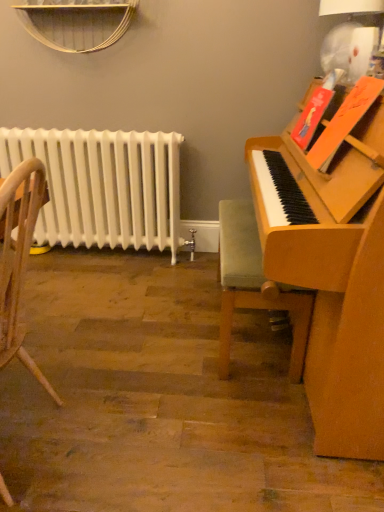
Question: Is white painted metal radiator at left positioned with its back to velvet green cushioned chair at right, which is counted as the second chair, starting from the left?

Choices:
 (A) no
 (B) yes

Answer: (A)

Question: Does white painted metal radiator at left turn towards velvet green cushioned chair at right, the first chair in the back-to-front sequence?

Choices:
 (A) yes
 (B) no

Answer: (B)

Question: Is the depth of white painted metal radiator at left greater than that of velvet green cushioned chair at right, placed as the second chair when sorted from front to back?

Choices:
 (A) yes
 (B) no

Answer: (A)

Question: Considering the relative positions of white painted metal radiator at left and velvet green cushioned chair at right, which is counted as the second chair, starting from the left, in the image provided, is white painted metal radiator at left to the right of velvet green cushioned chair at right, which is counted as the second chair, starting from the left, from the viewer's perspective?

Choices:
 (A) yes
 (B) no

Answer: (B)

Question: Would you say white painted metal radiator at left is a long distance from velvet green cushioned chair at right, placed as the second chair when sorted from front to back?

Choices:
 (A) no
 (B) yes

Answer: (A)

Question: From the image's perspective, would you say white painted metal radiator at left is shown under velvet green cushioned chair at right, the first chair in the back-to-front sequence?

Choices:
 (A) yes
 (B) no

Answer: (B)

Question: Is velvet green cushioned chair at right, which is counted as the second chair, starting from the left, far from wooden chair at left, arranged as the first chair when viewed from the front?

Choices:
 (A) no
 (B) yes

Answer: (A)

Question: Can you confirm if velvet green cushioned chair at right, the 1th chair viewed from the right, is thinner than wooden chair at left, arranged as the first chair when viewed from the front?

Choices:
 (A) no
 (B) yes

Answer: (B)

Question: Is velvet green cushioned chair at right, the 1th chair viewed from the right, aimed at wooden chair at left, the 1th chair when ordered from left to right?

Choices:
 (A) yes
 (B) no

Answer: (B)

Question: From the image's perspective, is velvet green cushioned chair at right, the first chair in the back-to-front sequence, beneath wooden chair at left, which is counted as the second chair, starting from the back?

Choices:
 (A) no
 (B) yes

Answer: (A)

Question: Can you confirm if velvet green cushioned chair at right, the 1th chair viewed from the right, is bigger than wooden chair at left, which appears as the second chair when viewed from the right?

Choices:
 (A) no
 (B) yes

Answer: (A)

Question: Can you confirm if velvet green cushioned chair at right, the 1th chair viewed from the right, is wider than wooden chair at left, the 1th chair when ordered from left to right?

Choices:
 (A) yes
 (B) no

Answer: (B)

Question: Are wooden chair at left, arranged as the first chair when viewed from the front, and white painted metal radiator at left far apart?

Choices:
 (A) no
 (B) yes

Answer: (B)